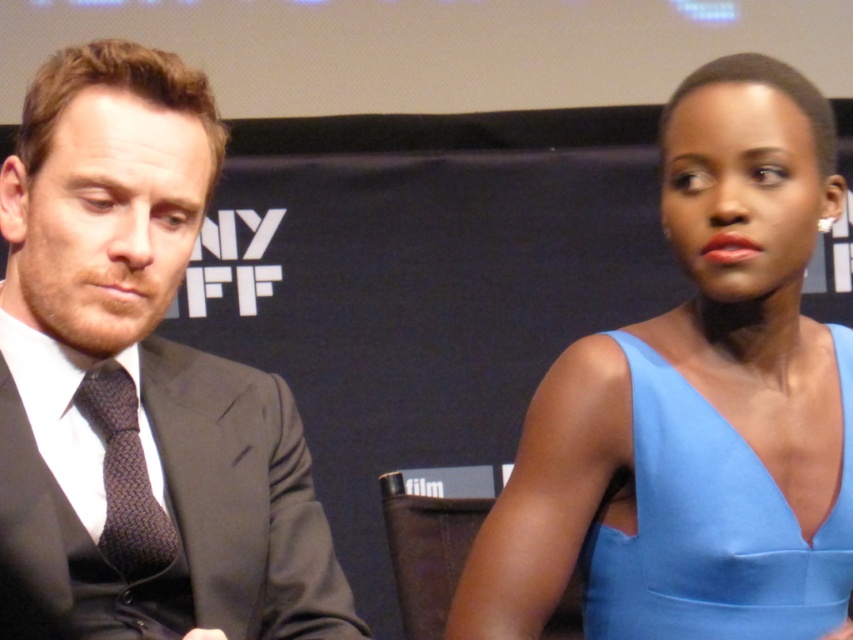
Question: Which point is closer to the camera taking this photo?

Choices:
 (A) (689, 390)
 (B) (772, 461)
 (C) (49, 416)
 (D) (108, 413)

Answer: (C)

Question: Which point is farther to the camera?

Choices:
 (A) matte black suit at left
 (B) blue satin dress at right
 (C) dark brown textured tie at left

Answer: (C)

Question: Which is farther from the light blue satin dress at right?

Choices:
 (A) dark brown textured tie at left
 (B) blue satin dress at right

Answer: (A)

Question: In this image, where is light blue satin dress at right located relative to dark brown textured tie at left?

Choices:
 (A) left
 (B) right

Answer: (B)

Question: Observing the image, what is the correct spatial positioning of blue satin dress at right in reference to light blue satin dress at right?

Choices:
 (A) left
 (B) right

Answer: (A)

Question: Does blue satin dress at right lie behind light blue satin dress at right?

Choices:
 (A) no
 (B) yes

Answer: (A)